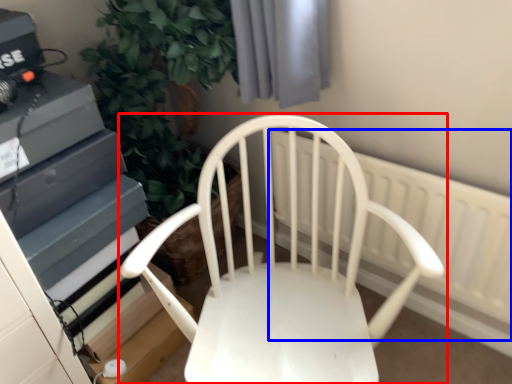
Question: Which object appears closest to the camera in this image, chair (highlighted by a red box) or radiator (highlighted by a blue box)?

Choices:
 (A) chair
 (B) radiator

Answer: (A)